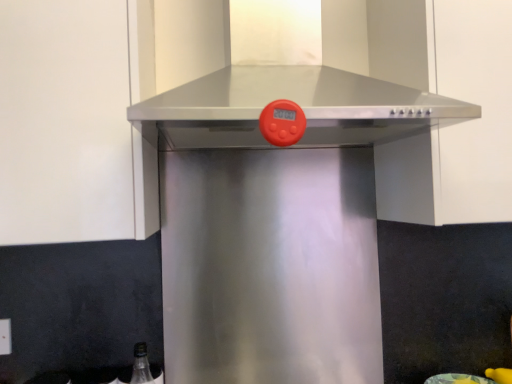
Question: Is stainless steel vent at center wider or thinner than stainless steel range hood at center?

Choices:
 (A) wide
 (B) thin

Answer: (A)

Question: Is stainless steel vent at center inside or outside of stainless steel range hood at center?

Choices:
 (A) outside
 (B) inside

Answer: (A)

Question: Considering the positions of point (192, 127) and point (507, 129), is point (192, 127) closer or farther from the camera than point (507, 129)?

Choices:
 (A) farther
 (B) closer

Answer: (B)

Question: From a real-world perspective, is stainless steel range hood at center above or below stainless steel vent at center?

Choices:
 (A) below
 (B) above

Answer: (A)

Question: Is stainless steel range hood at center taller or shorter than stainless steel vent at center?

Choices:
 (A) short
 (B) tall

Answer: (B)

Question: Choose the correct answer: Is stainless steel range hood at center inside stainless steel vent at center or outside it?

Choices:
 (A) inside
 (B) outside

Answer: (B)

Question: Based on their sizes in the image, would you say stainless steel range hood at center is bigger or smaller than stainless steel vent at center?

Choices:
 (A) big
 (B) small

Answer: (B)